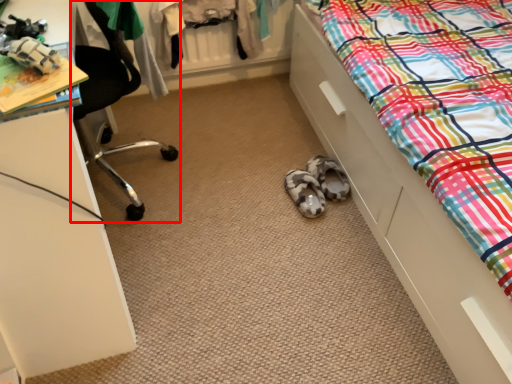
Question: Considering the relative positions of chair (annotated by the red box) and bed in the image provided, where is chair (annotated by the red box) located with respect to the staircase?

Choices:
 (A) right
 (B) left

Answer: (B)